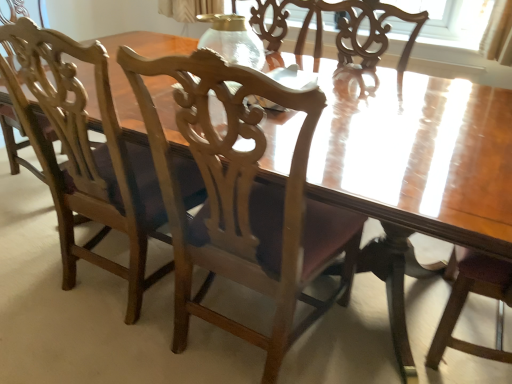
Question: From a real-world perspective, is transparent glass vase at center over wooden chair at center, the 2th chair from the left?

Choices:
 (A) no
 (B) yes

Answer: (B)

Question: From the image's perspective, is transparent glass vase at center under wooden chair at center, which ranks as the first chair in right-to-left order?

Choices:
 (A) yes
 (B) no

Answer: (B)

Question: Does transparent glass vase at center have a larger size compared to wooden chair at center, the 2th chair from the left?

Choices:
 (A) yes
 (B) no

Answer: (B)

Question: Is transparent glass vase at center completely or partially outside of wooden chair at center, the 2th chair from the left?

Choices:
 (A) yes
 (B) no

Answer: (A)

Question: Can you confirm if transparent glass vase at center is taller than wooden chair at center, which ranks as the first chair in right-to-left order?

Choices:
 (A) yes
 (B) no

Answer: (B)

Question: Would you say transparent glass vase at center is inside or outside wooden chair at left, which is the 1th chair in left-to-right order?

Choices:
 (A) outside
 (B) inside

Answer: (A)

Question: Considering the positions of point (216, 41) and point (42, 82), is point (216, 41) closer or farther from the camera than point (42, 82)?

Choices:
 (A) farther
 (B) closer

Answer: (A)

Question: Is transparent glass vase at center to the left or to the right of wooden chair at left, which is the 1th chair in left-to-right order, in the image?

Choices:
 (A) right
 (B) left

Answer: (A)

Question: From their relative heights in the image, would you say transparent glass vase at center is taller or shorter than wooden chair at left, placed as the 2th chair when sorted from right to left?

Choices:
 (A) short
 (B) tall

Answer: (A)

Question: Looking at their shapes, would you say wooden chair at left, placed as the 2th chair when sorted from right to left, is wider or thinner than wooden chair at center, which ranks as the first chair in right-to-left order?

Choices:
 (A) thin
 (B) wide

Answer: (A)

Question: From a real-world perspective, relative to wooden chair at center, the 2th chair from the left, is wooden chair at left, which is the 1th chair in left-to-right order, vertically above or below?

Choices:
 (A) below
 (B) above

Answer: (B)

Question: From their relative heights in the image, would you say wooden chair at left, which is the 1th chair in left-to-right order, is taller or shorter than wooden chair at center, which ranks as the first chair in right-to-left order?

Choices:
 (A) tall
 (B) short

Answer: (A)

Question: Is wooden chair at left, placed as the 2th chair when sorted from right to left, to the left or to the right of wooden chair at center, the 2th chair from the left, in the image?

Choices:
 (A) right
 (B) left

Answer: (B)

Question: Is wooden chair at center, which ranks as the first chair in right-to-left order, wider or thinner than wooden chair at left, which is the 1th chair in left-to-right order?

Choices:
 (A) thin
 (B) wide

Answer: (B)

Question: Considering the positions of wooden chair at center, which ranks as the first chair in right-to-left order, and wooden chair at left, which is the 1th chair in left-to-right order, in the image, is wooden chair at center, which ranks as the first chair in right-to-left order, taller or shorter than wooden chair at left, which is the 1th chair in left-to-right order,?

Choices:
 (A) short
 (B) tall

Answer: (A)